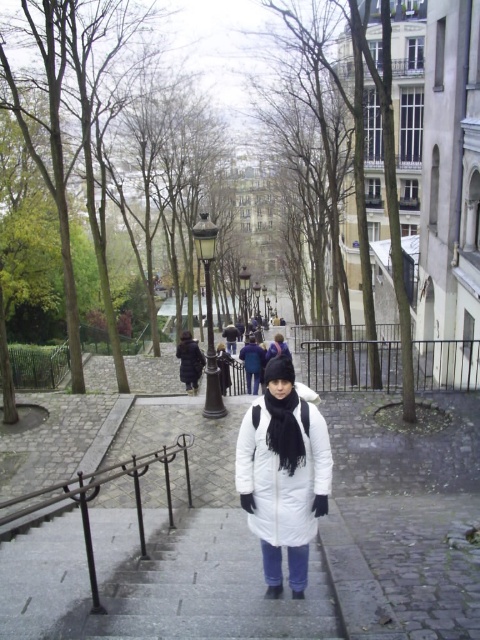
Question: Which point appears farthest from the camera in this image?

Choices:
 (A) (304, 488)
 (B) (187, 344)
 (C) (217, 593)
 (D) (472, 385)

Answer: (B)

Question: Which point is closer to the camera taking this photo?

Choices:
 (A) (248, 602)
 (B) (304, 356)
 (C) (241, 477)
 (D) (28, 506)

Answer: (C)

Question: Does gray stone stairs at center lie behind black wrought iron railing at lower center?

Choices:
 (A) no
 (B) yes

Answer: (A)

Question: Which point is closer to the camera?

Choices:
 (A) white matte jacket at center
 (B) gray stone stairs at center

Answer: (B)

Question: Can you confirm if black metal rail at right is positioned below black wrought iron railing at lower center?

Choices:
 (A) no
 (B) yes

Answer: (A)

Question: Does gray stone stairs at center have a lesser width compared to black wrought iron railing at lower center?

Choices:
 (A) yes
 (B) no

Answer: (B)